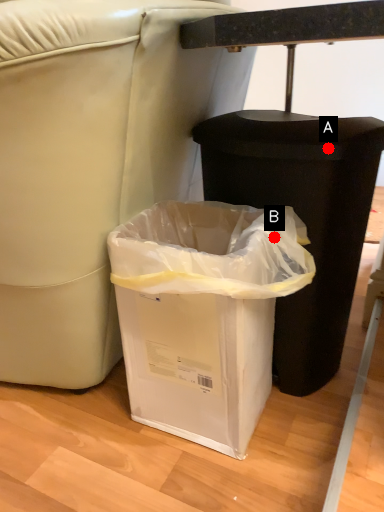
Question: Two points are circled on the image, labeled by A and B beside each circle. Which point is closer to the camera taking this photo?

Choices:
 (A) A is closer
 (B) B is closer

Answer: (A)